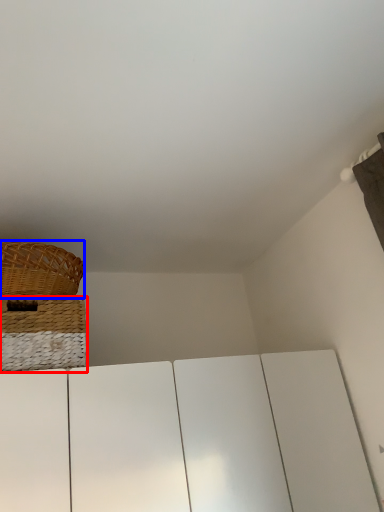
Question: Which point is further to the camera, basket (highlighted by a red box) or picnic basket (highlighted by a blue box)?

Choices:
 (A) basket
 (B) picnic basket

Answer: (B)